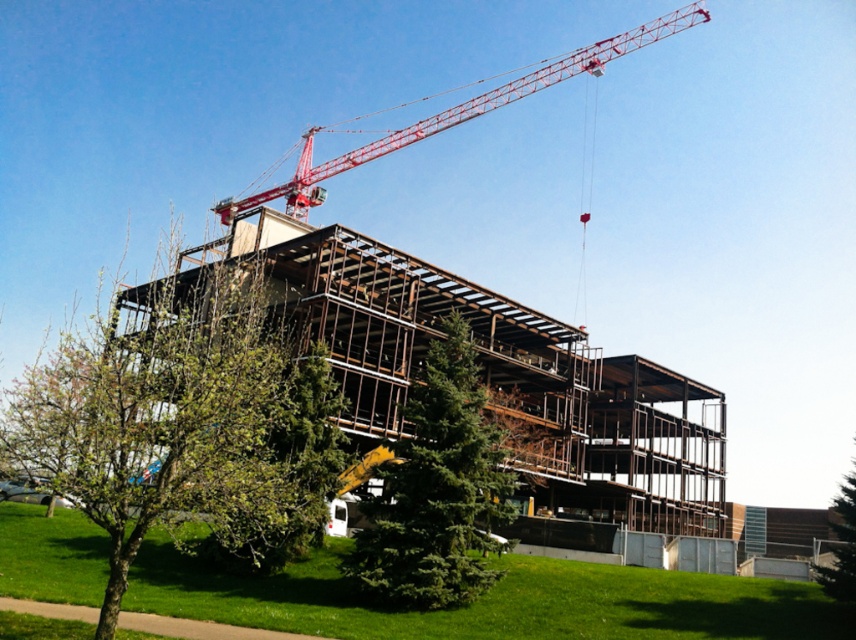
Between red metallic crane at upper center and green textured tree at lower right, which one is positioned higher?

Positioned higher is red metallic crane at upper center.

Can you confirm if red metallic crane at upper center is taller than green textured tree at lower right?

Yes.

Where is `red metallic crane at upper center`? The height and width of the screenshot is (640, 856). red metallic crane at upper center is located at coordinates (459, 113).

I want to click on red metallic crane at upper center, so click(459, 113).

Can you confirm if green evergreen tree at center is wider than red metallic crane at upper center?

In fact, green evergreen tree at center might be narrower than red metallic crane at upper center.

Is green evergreen tree at center taller than red metallic crane at upper center?

No.

Between point (417, 515) and point (691, 12), which one is positioned behind?

The point (691, 12) is more distant.

At what (x,y) coordinates should I click in order to perform the action: click on green evergreen tree at center. Please return your answer as a coordinate pair (x, y). Image resolution: width=856 pixels, height=640 pixels. Looking at the image, I should click on (437, 490).

Between green leafy tree at center and red metallic crane at upper center, which one appears on the left side from the viewer's perspective?

From the viewer's perspective, green leafy tree at center appears more on the left side.

Is green leafy tree at center taller than red metallic crane at upper center?

In fact, green leafy tree at center may be shorter than red metallic crane at upper center.

Does point (195, 316) come closer to viewer compared to point (629, 40)?

Yes.

Locate an element on the screen. green leafy tree at center is located at coordinates (183, 422).